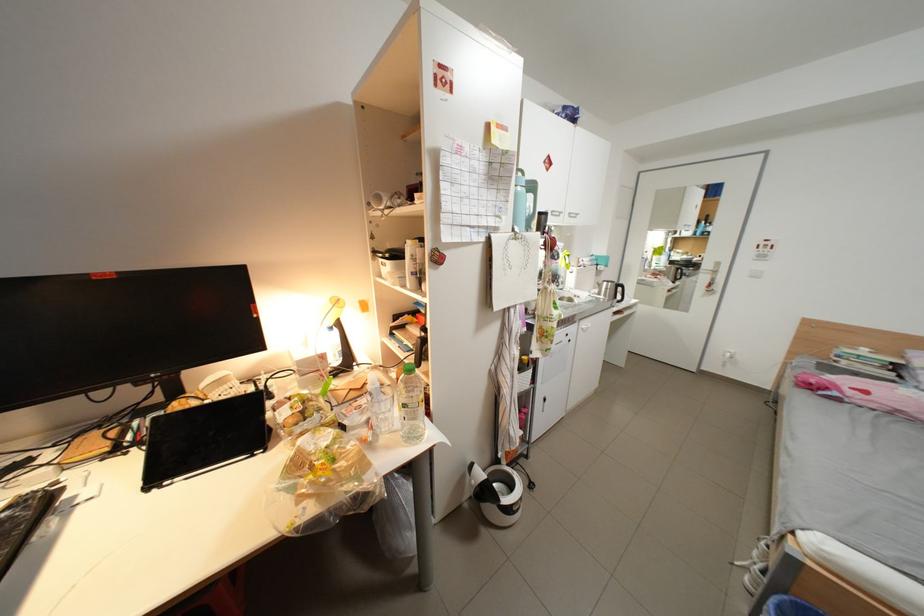
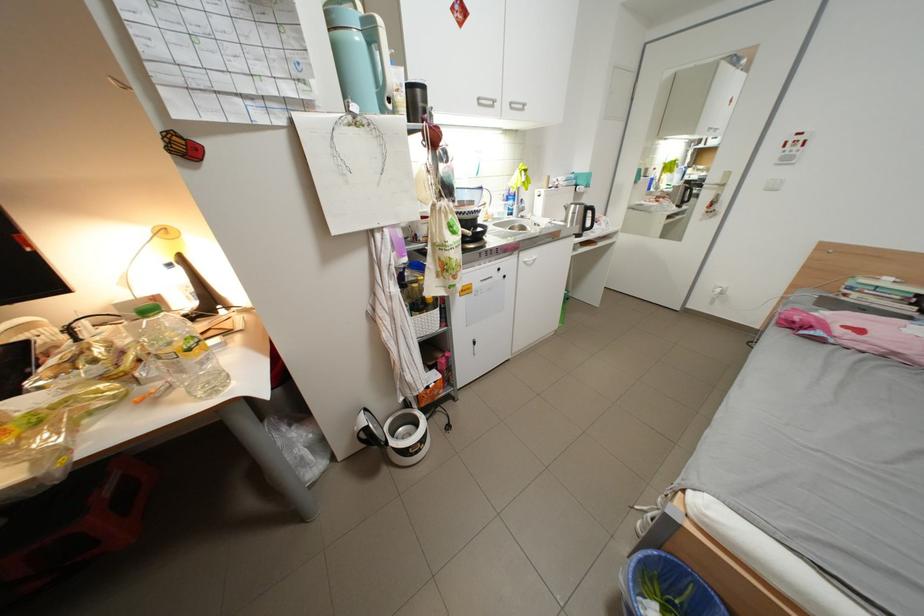
In a continuous first-person perspective shot, in which direction is the camera moving?

The cameraman walked toward right, forward.